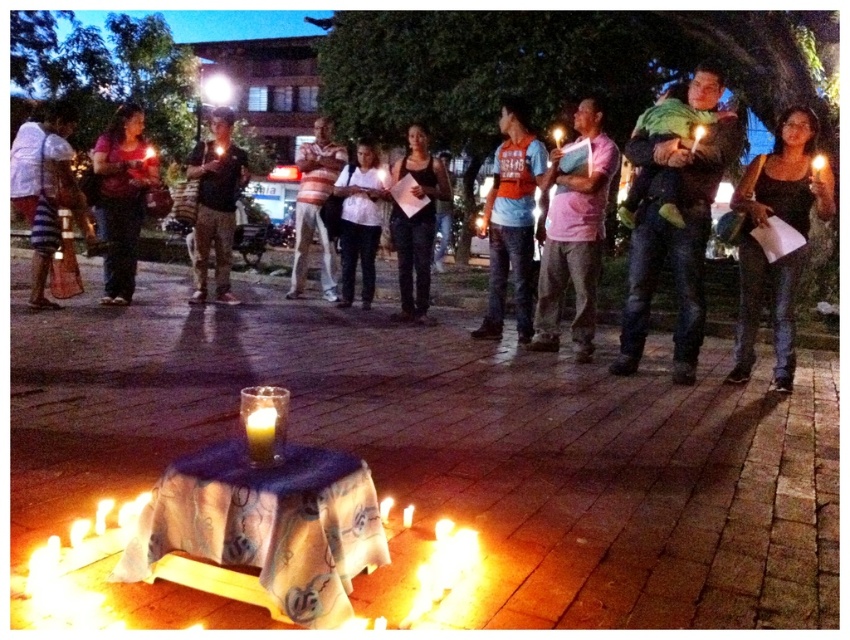
Does point (37, 266) lie behind point (119, 145)?

That is False.

Who is taller, striped fabric bag at left or matte black shirt at left?

matte black shirt at left

Who is more distant from viewer, [68,124] or [99,195]?

Positioned behind is point [99,195].

Find the location of a particular element. striped fabric bag at left is located at coordinates (44, 188).

Who is lower down, striped fabric bag at left or translucent glass candle at lower left?

translucent glass candle at lower left is below.

Can you confirm if striped fabric bag at left is positioned to the right of translucent glass candle at lower left?

In fact, striped fabric bag at left is to the left of translucent glass candle at lower left.

Describe the element at coordinates (44, 188) in the screenshot. I see `striped fabric bag at left` at that location.

You are a GUI agent. You are given a task and a screenshot of the screen. Output one action in this format:
    pyautogui.click(x=<x>, y=<y>)
    Task: Click on the striped fabric bag at left
    
    Given the screenshot: What is the action you would take?
    pyautogui.click(x=44, y=188)

Is denim jeans at right smaller than yellow wax candle at center?

Actually, denim jeans at right might be larger than yellow wax candle at center.

Is denim jeans at right to the left of yellow wax candle at center from the viewer's perspective?

In fact, denim jeans at right is to the right of yellow wax candle at center.

Image resolution: width=850 pixels, height=640 pixels. Find the location of `denim jeans at right`. denim jeans at right is located at coordinates (762, 248).

Locate an element on the screen. Image resolution: width=850 pixels, height=640 pixels. denim jeans at right is located at coordinates (762, 248).